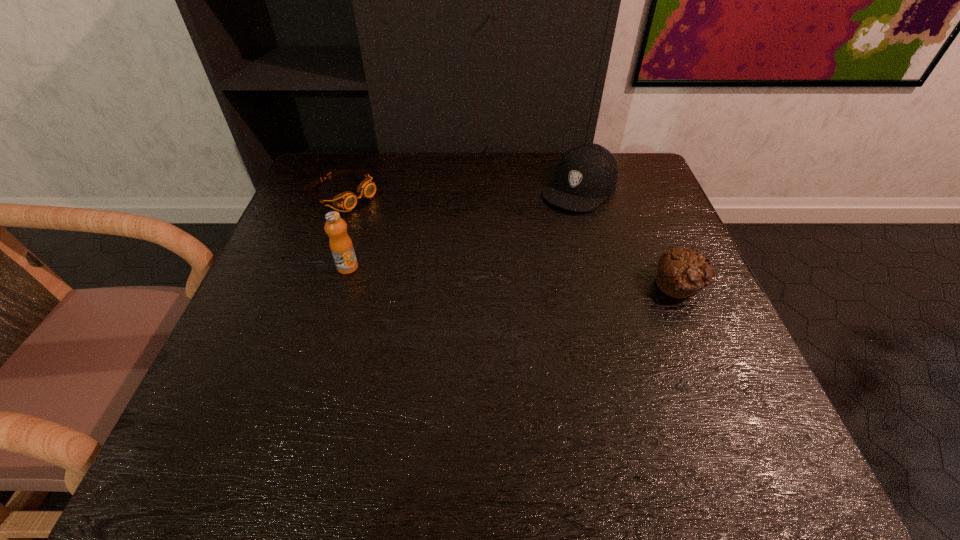
Identify the location of vacant area situated with the lenses facing forward on the shortest object. (461, 259).

Where is `blank space located 0.360m with the lenses facing forward on the shortest object`? This screenshot has height=540, width=960. blank space located 0.360m with the lenses facing forward on the shortest object is located at coordinates coord(478,268).

This screenshot has height=540, width=960. In order to click on cap located in the far edge section of the desktop in this screenshot , I will do `click(587, 173)`.

What are the coordinates of `goggles located at the far edge` in the screenshot? It's located at (347, 200).

Image resolution: width=960 pixels, height=540 pixels. What are the coordinates of `orange juice present at the left edge` in the screenshot? It's located at (340, 243).

In order to click on goggles at the left edge in this screenshot , I will do `click(347, 200)`.

Locate an element on the screen. The image size is (960, 540). muffin that is at the right edge is located at coordinates 681,271.

I want to click on cap at the right edge, so click(587, 173).

Find the location of a particular element. object that is at the far left corner is located at coordinates (347, 200).

Locate an element on the screen. The image size is (960, 540). object present at the far right corner is located at coordinates (587, 173).